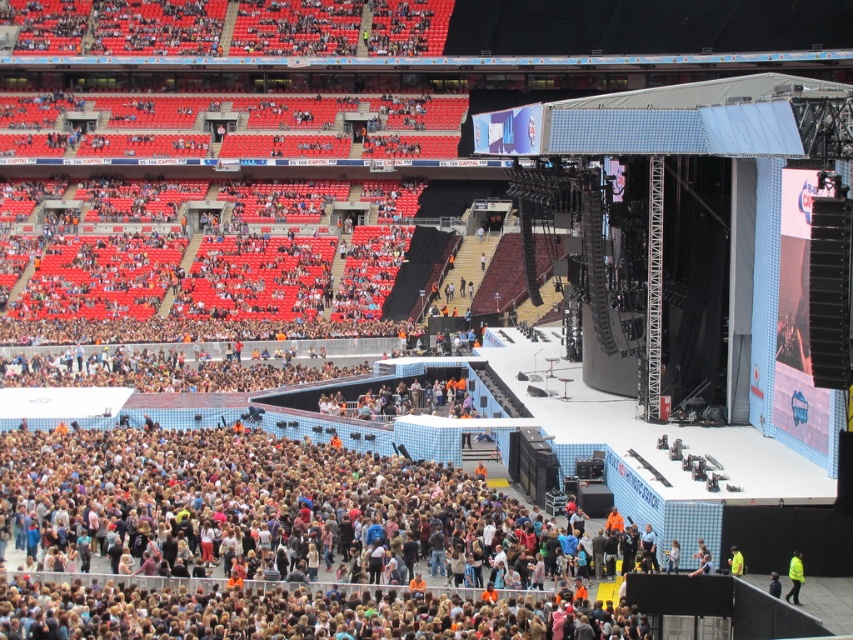
Who is higher up, yellow reflective vest at lower right or yellow fabric at lower right?

yellow fabric at lower right is higher up.

Does point (798, 588) come in front of point (735, 572)?

Yes.

Which is behind, point (804, 579) or point (737, 547)?

Positioned behind is point (737, 547).

This screenshot has height=640, width=853. In order to click on yellow reflective vest at lower right in this screenshot , I will do `click(793, 577)`.